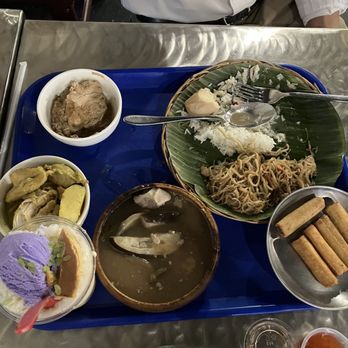
Locate an element on the screen. The image size is (348, 348). plate is located at coordinates coord(182,250), coord(188,161), coord(295,277).